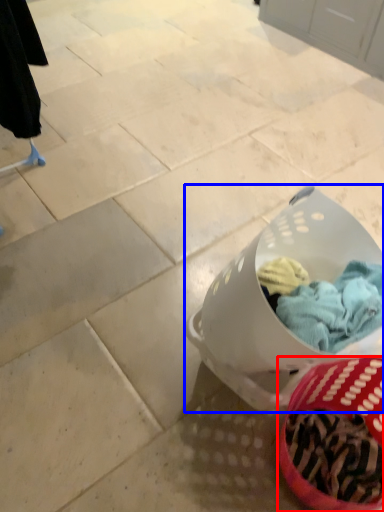
Question: Among these objects, which one is nearest to the camera, basket (highlighted by a red box) or laundry basket (highlighted by a blue box)?

Choices:
 (A) basket
 (B) laundry basket

Answer: (A)